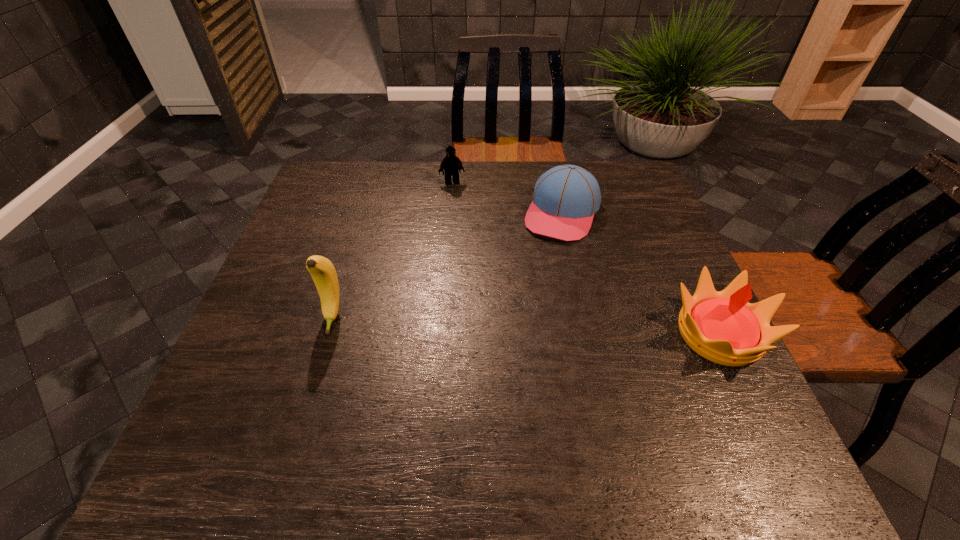
Where is `free spot on the desktop that is between the banana and the crown and is positioned on the front-facing side of the baseball cap`? free spot on the desktop that is between the banana and the crown and is positioned on the front-facing side of the baseball cap is located at coordinates (511, 325).

What are the coordinates of `free space on the desktop that is between the banana and the rightmost object and is positioned on the face of the second object from left to right` in the screenshot? It's located at click(492, 325).